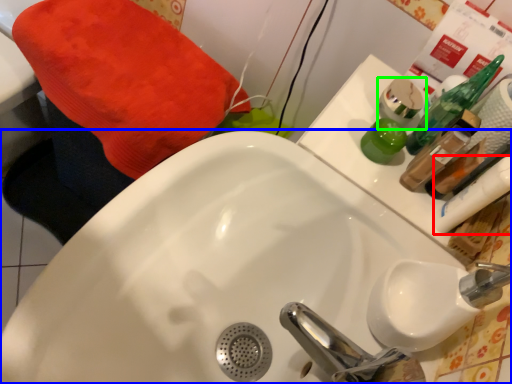
Question: Which is farther away from mouthwash (highlighted by a red box)? sink (highlighted by a blue box) or mouthwash (highlighted by a green box)?

Choices:
 (A) sink
 (B) mouthwash

Answer: (A)